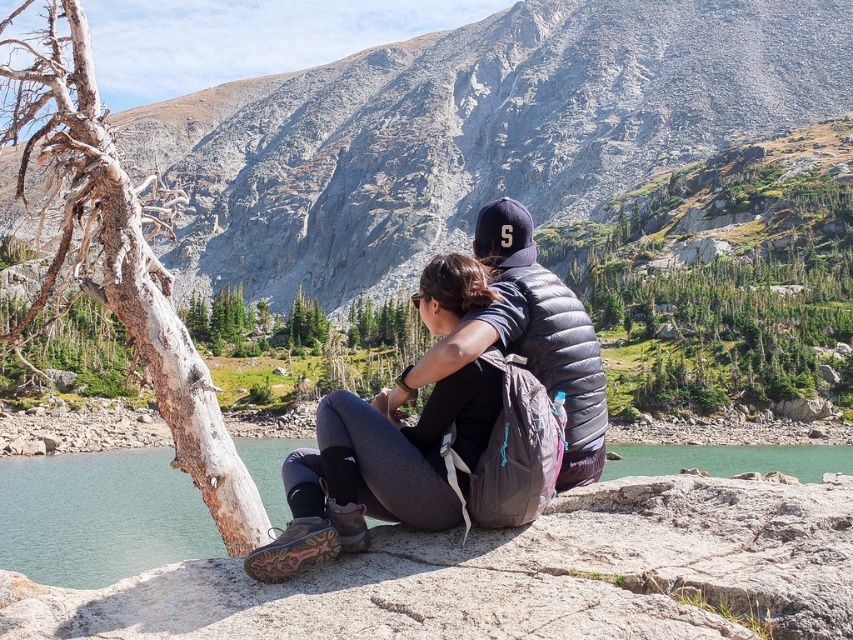
Does matte gray rock at center appear on the left side of green smooth rock at lower center?

Yes, matte gray rock at center is to the left of green smooth rock at lower center.

Between point (302, 122) and point (119, 513), which one is positioned in front?

Positioned in front is point (119, 513).

Who is more forward, (579, 160) or (775, 468)?

Point (775, 468)

At what (x,y) coordinates should I click in order to perform the action: click on matte gray rock at center. Please return your answer as a coordinate pair (x, y). The height and width of the screenshot is (640, 853). Looking at the image, I should click on (473, 132).

Which is below, matte gray rock at center or matte black backpack at center?

matte black backpack at center is lower down.

Which is above, matte gray rock at center or matte black backpack at center?

Positioned higher is matte gray rock at center.

Does point (840, 80) lie behind point (424, 406)?

Yes, it is.

The width and height of the screenshot is (853, 640). What are the coordinates of `matte gray rock at center` in the screenshot? It's located at (473, 132).

Who is more distant from viewer, (618,12) or (160,276)?

The point (618,12) is behind.

Is matte gray rock at center smaller than gray bark tree at left?

No.

Locate an element on the screen. The width and height of the screenshot is (853, 640). matte gray rock at center is located at coordinates (473, 132).